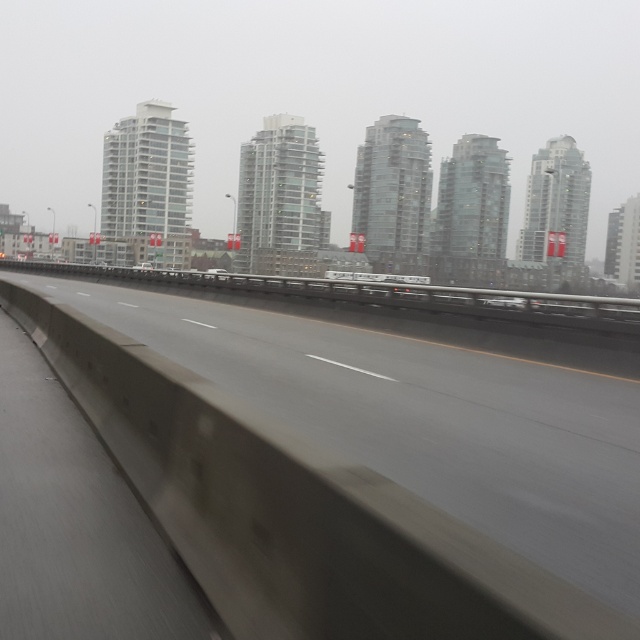
Can you confirm if concrete at center is bigger than white glossy car at center?

No.

Measure the distance from concrete at center to white glossy car at center.

35.11 meters

Describe the element at coordinates (355, 483) in the screenshot. The image size is (640, 640). I see `concrete at center` at that location.

Identify the location of concrete at center. This screenshot has width=640, height=640. (355, 483).